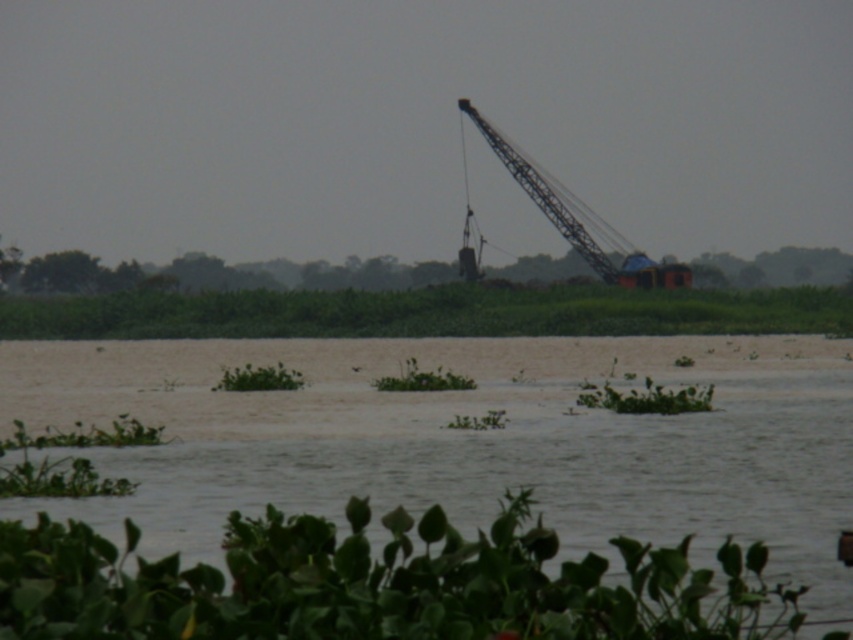
Question: Does green leafy plant at lower center have a smaller size compared to metallic gray crane at upper center?

Choices:
 (A) no
 (B) yes

Answer: (B)

Question: Does green leafy plant at lower center lie behind metallic gray crane at upper center?

Choices:
 (A) no
 (B) yes

Answer: (A)

Question: Is green leafy plants at center smaller than metallic gray crane at upper center?

Choices:
 (A) no
 (B) yes

Answer: (A)

Question: Which of these objects is positioned farthest from the green leafy plants at center?

Choices:
 (A) green leafy plant at lower center
 (B) metallic gray crane at upper center

Answer: (A)

Question: Which object is positioned closest to the green leafy plants at center?

Choices:
 (A) metallic gray crane at upper center
 (B) green leafy plant at lower center

Answer: (A)

Question: Which object appears farthest from the camera in this image?

Choices:
 (A) metallic gray crane at upper center
 (B) green leafy plant at lower center
 (C) green leafy plants at center

Answer: (A)